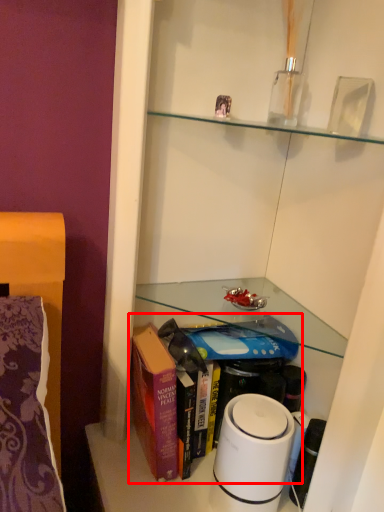
Question: In this image, where is book (annotated by the red box) located relative to home appliance?

Choices:
 (A) left
 (B) right

Answer: (A)